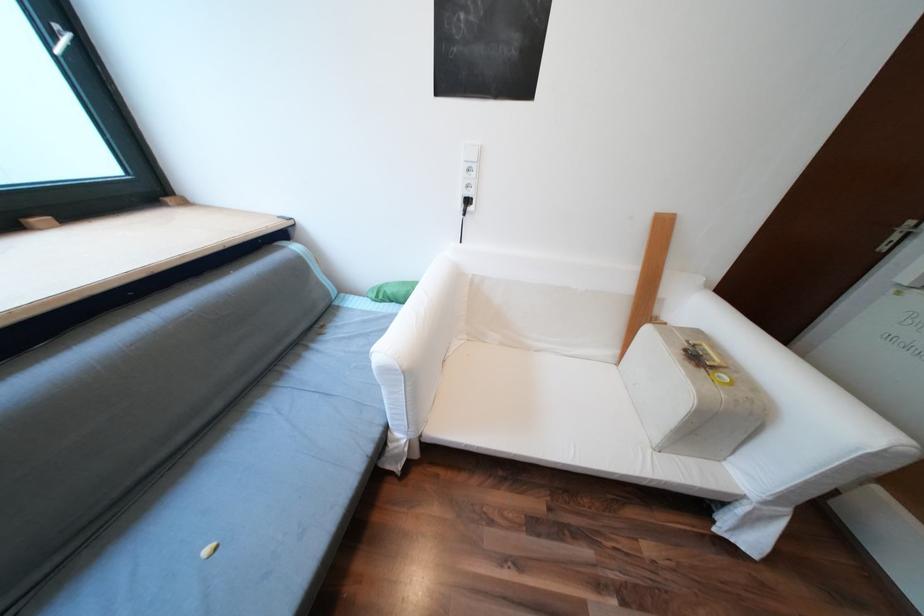
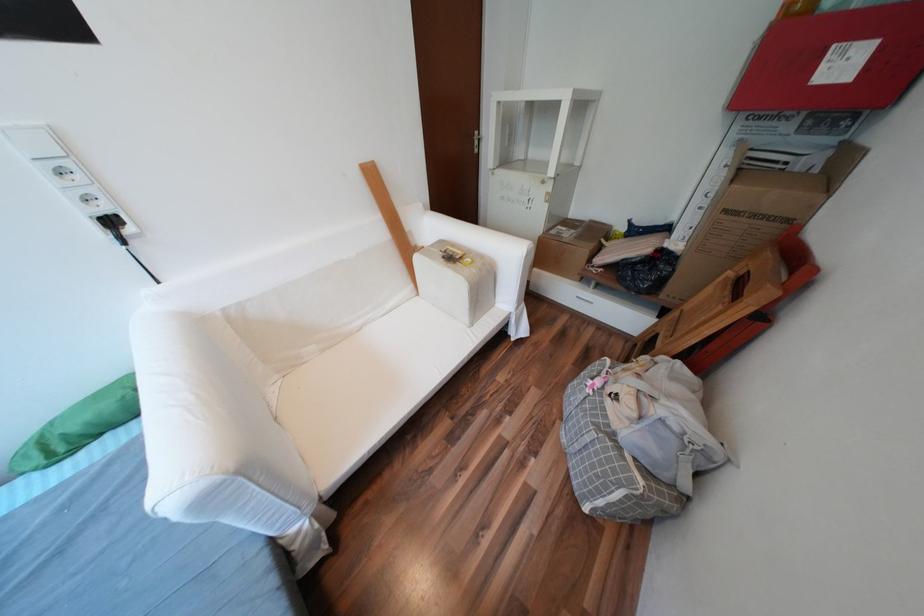
Where in the second image is the point corresponding to point 480,209 from the first image?

(138, 231)